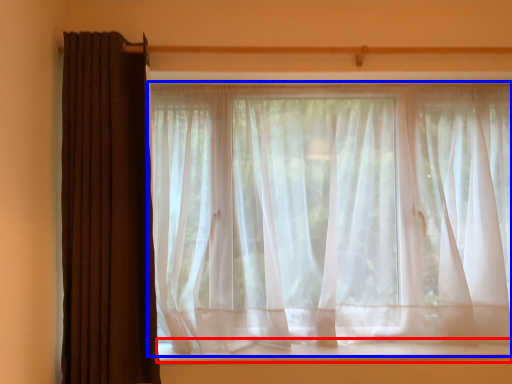
Question: Which point is further to the camera, window sill (highlighted by a red box) or curtain (highlighted by a blue box)?

Choices:
 (A) window sill
 (B) curtain

Answer: (A)